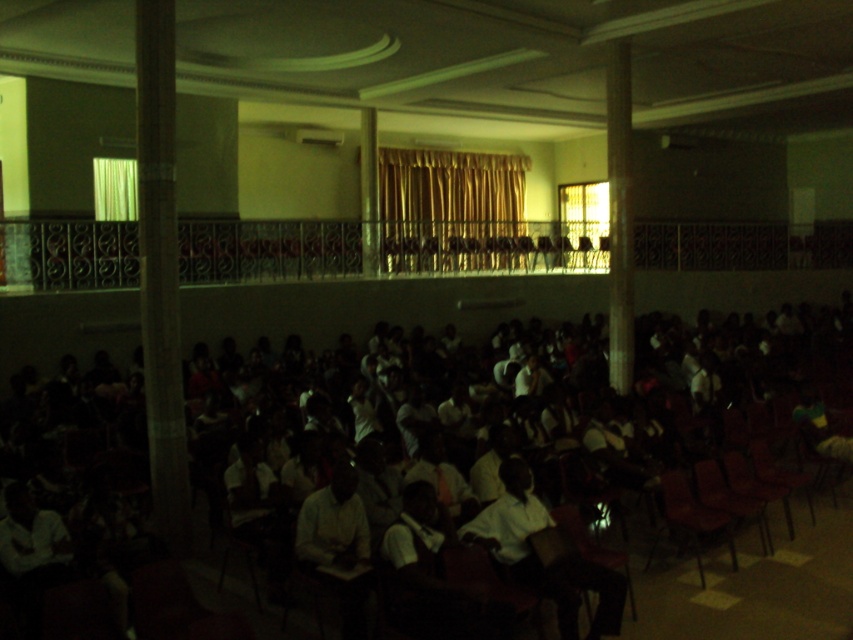
Does metallic brown chair at lower right appear on the right side of brown leather chair at lower right?

No, metallic brown chair at lower right is not to the right of brown leather chair at lower right.

Between metallic brown chair at lower right and brown leather chair at lower right, which one is positioned lower?

metallic brown chair at lower right is below.

Is point (682, 483) farther from viewer compared to point (694, 477)?

No, (682, 483) is closer to viewer.

The width and height of the screenshot is (853, 640). Identify the location of metallic brown chair at lower right. (689, 516).

Between point (648, 552) and point (747, 467), which one is positioned behind?

The point (747, 467) is more distant.

Between metallic brown chair at lower right and matte brown chair at center, which one appears on the right side from the viewer's perspective?

From the viewer's perspective, matte brown chair at center appears more on the right side.

Is point (693, 532) more distant than point (787, 516)?

That is False.

I want to click on metallic brown chair at lower right, so click(689, 516).

Does brown leather chair at lower right appear under matte brown chair at center?

Yes.

Can you confirm if brown leather chair at lower right is taller than matte brown chair at center?

Indeed, brown leather chair at lower right has a greater height compared to matte brown chair at center.

Does point (730, 490) lie behind point (782, 486)?

No.

Locate an element on the screen. Image resolution: width=853 pixels, height=640 pixels. brown leather chair at lower right is located at coordinates (729, 499).